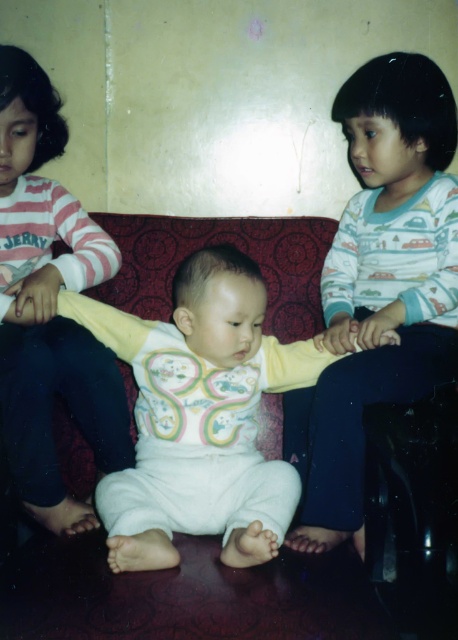
Question: Where is white cotton shirt at right located in relation to white soft baby at center in the image?

Choices:
 (A) right
 (B) left

Answer: (A)

Question: Which point appears closest to the camera in this image?

Choices:
 (A) (110, 317)
 (B) (413, 362)

Answer: (B)

Question: Does white cotton shirt at right appear over white soft onesie at center?

Choices:
 (A) yes
 (B) no

Answer: (A)

Question: Which of the following is the farthest from the observer?

Choices:
 (A) white soft baby at center
 (B) white soft onesie at center
 (C) white cotton shirt at right

Answer: (A)

Question: Which is nearer to the white soft baby at center?

Choices:
 (A) white soft onesie at center
 (B) white cotton shirt at right

Answer: (A)

Question: Can you confirm if white cotton shirt at right is smaller than white soft onesie at center?

Choices:
 (A) no
 (B) yes

Answer: (A)